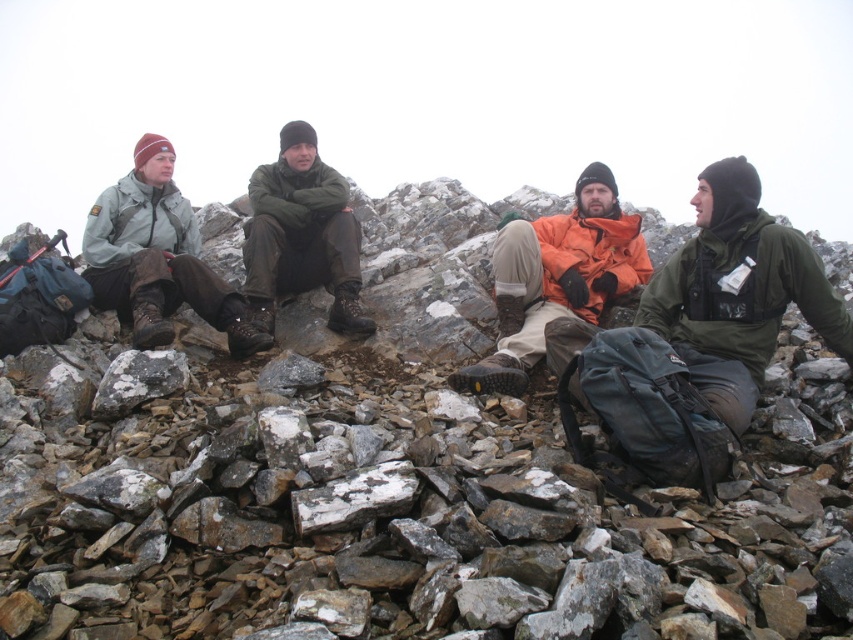
Who is positioned more to the left, rocky terrain at center or white speckled rock at center?

white speckled rock at center

Measure the distance from rocky terrain at center to white speckled rock at center.

rocky terrain at center and white speckled rock at center are 53.12 centimeters apart from each other.

The height and width of the screenshot is (640, 853). Find the location of `rocky terrain at center`. rocky terrain at center is located at coordinates (415, 500).

Between point (598, 209) and point (143, 380), which one is positioned behind?

Positioned behind is point (598, 209).

Who is positioned more to the left, orange fleece jacket at center or gray/white speckled rock at center?

From the viewer's perspective, gray/white speckled rock at center appears more on the left side.

This screenshot has height=640, width=853. What do you see at coordinates (556, 276) in the screenshot? I see `orange fleece jacket at center` at bounding box center [556, 276].

At what (x,y) coordinates should I click in order to perform the action: click on orange fleece jacket at center. Please return your answer as a coordinate pair (x, y). The width and height of the screenshot is (853, 640). Looking at the image, I should click on (556, 276).

Between green matte jacket at upper right and gray/white speckled rock at center, which one is positioned lower?

gray/white speckled rock at center is lower down.

Is green matte jacket at upper right shorter than gray/white speckled rock at center?

No.

Which is behind, point (686, 323) or point (141, 362)?

Point (686, 323)

Where is `green matte jacket at upper right`? green matte jacket at upper right is located at coordinates (738, 291).